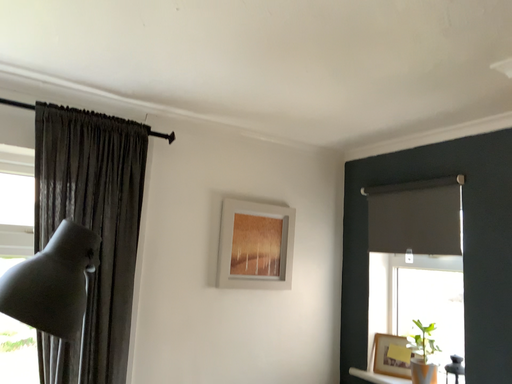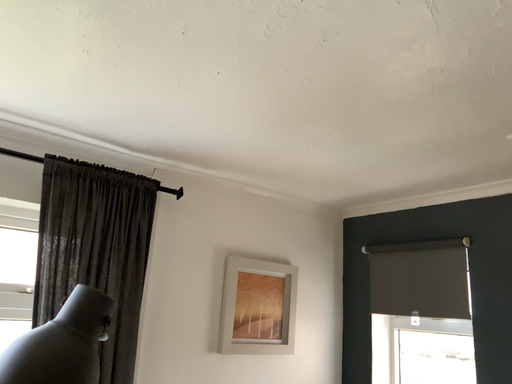
Question: Which way did the camera rotate in the video?

Choices:
 (A) rotated upward
 (B) rotated downward

Answer: (A)